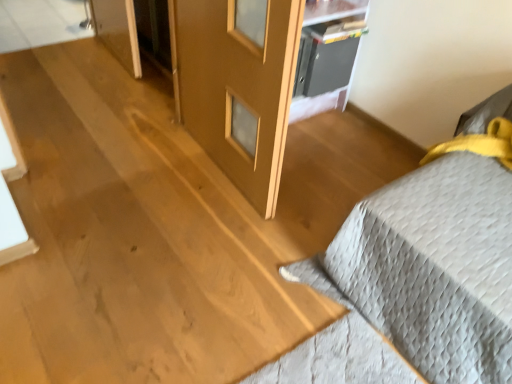
Question: Does gray quilted bedspread at right have a greater width compared to metallic gray cabinet at upper center?

Choices:
 (A) no
 (B) yes

Answer: (B)

Question: Is gray quilted bedspread at right touching metallic gray cabinet at upper center?

Choices:
 (A) yes
 (B) no

Answer: (B)

Question: From a real-world perspective, is gray quilted bedspread at right physically below metallic gray cabinet at upper center?

Choices:
 (A) yes
 (B) no

Answer: (B)

Question: Considering the relative sizes of gray quilted bedspread at right and metallic gray cabinet at upper center in the image provided, is gray quilted bedspread at right bigger than metallic gray cabinet at upper center?

Choices:
 (A) yes
 (B) no

Answer: (A)

Question: From the image's perspective, is gray quilted bedspread at right above metallic gray cabinet at upper center?

Choices:
 (A) yes
 (B) no

Answer: (B)

Question: Is gray quilted bedspread at right at the left side of metallic gray cabinet at upper center?

Choices:
 (A) yes
 (B) no

Answer: (B)

Question: From a real-world perspective, is matte wood screen door at center positioned under gray quilted bedspread at right based on gravity?

Choices:
 (A) yes
 (B) no

Answer: (B)

Question: Does matte wood screen door at center contain gray quilted bedspread at right?

Choices:
 (A) yes
 (B) no

Answer: (B)

Question: Is matte wood screen door at center completely or partially outside of gray quilted bedspread at right?

Choices:
 (A) no
 (B) yes

Answer: (B)

Question: Is matte wood screen door at center looking in the opposite direction of gray quilted bedspread at right?

Choices:
 (A) yes
 (B) no

Answer: (B)

Question: Can you confirm if matte wood screen door at center is positioned to the left of gray quilted bedspread at right?

Choices:
 (A) no
 (B) yes

Answer: (B)

Question: Can you confirm if matte wood screen door at center is shorter than gray quilted bedspread at right?

Choices:
 (A) yes
 (B) no

Answer: (B)

Question: Can you confirm if gray quilted bedspread at right is positioned to the left of matte wood screen door at center?

Choices:
 (A) yes
 (B) no

Answer: (B)